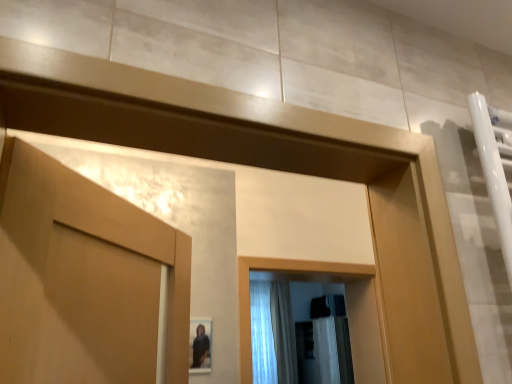
Question: From a real-world perspective, is white sheer fabric at center, acting as the second shower curtain starting from the left, physically located above or below white sheer fabric at center, positioned as the first shower curtain in left-to-right order?

Choices:
 (A) above
 (B) below

Answer: (B)

Question: Is white sheer fabric at center, acting as the second shower curtain starting from the left, bigger or smaller than white sheer fabric at center, the 2th shower curtain in the right-to-left sequence?

Choices:
 (A) big
 (B) small

Answer: (A)

Question: Is white sheer fabric at center, which is counted as the first shower curtain, starting from the right, spatially inside white sheer fabric at center, the 2th shower curtain in the right-to-left sequence, or outside of it?

Choices:
 (A) inside
 (B) outside

Answer: (B)

Question: From the image's perspective, relative to white sheer fabric at center, which is counted as the first shower curtain, starting from the right, is white sheer fabric at center, the 2th shower curtain in the right-to-left sequence, above or below?

Choices:
 (A) below
 (B) above

Answer: (B)

Question: Is point (276, 380) positioned closer to the camera than point (272, 291)?

Choices:
 (A) farther
 (B) closer

Answer: (B)

Question: Is white sheer fabric at center, positioned as the first shower curtain in left-to-right order, wider or thinner than white sheer fabric at center, which is counted as the first shower curtain, starting from the right?

Choices:
 (A) thin
 (B) wide

Answer: (A)

Question: From a real-world perspective, is white sheer fabric at center, the 2th shower curtain in the right-to-left sequence, positioned above or below white sheer fabric at center, which is counted as the first shower curtain, starting from the right?

Choices:
 (A) below
 (B) above

Answer: (B)